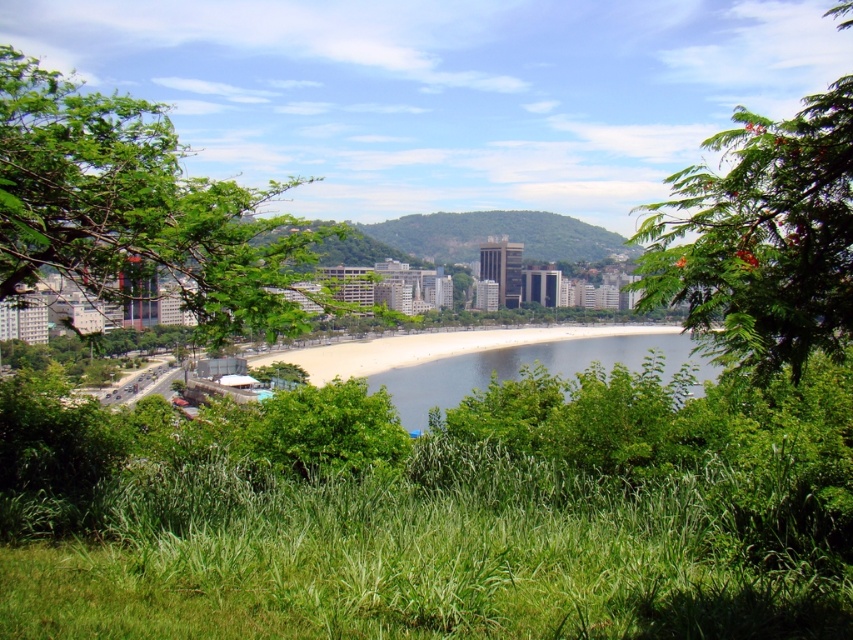
Does green leafy tree at center have a lesser height compared to white sand beach at center?

→ Incorrect, green leafy tree at center's height does not fall short of white sand beach at center's.

Consider the image. Is green leafy tree at center wider than white sand beach at center?

No.

Who is more forward, [39,200] or [676,332]?

Point [39,200] is in front.

This screenshot has height=640, width=853. What are the coordinates of `green leafy tree at center` in the screenshot? It's located at (136, 209).

Is green grass at lower center positioned behind green leafy tree at upper right?

Yes, it is behind green leafy tree at upper right.

Is green grass at lower center below green leafy tree at upper right?

Yes.

At what (x,y) coordinates should I click in order to perform the action: click on green grass at lower center. Please return your answer as a coordinate pair (x, y). Looking at the image, I should click on (433, 556).

At what (x,y) coordinates should I click in order to perform the action: click on green grass at lower center. Please return your answer as a coordinate pair (x, y). Looking at the image, I should click on (433, 556).

Does green grass at lower center have a lesser height compared to white sand beach at center?

No.

Does green grass at lower center lie in front of white sand beach at center?

Yes.

Does point (618, 625) come farther from viewer compared to point (378, 369)?

No.

At what (x,y) coordinates should I click in order to perform the action: click on green grass at lower center. Please return your answer as a coordinate pair (x, y). The image size is (853, 640). Looking at the image, I should click on (433, 556).